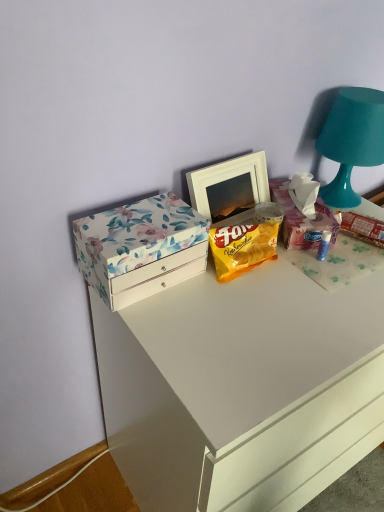
Question: From a real-world perspective, is teal matte table lamp at upper right positioned above or below white glossy chest of drawers at upper center?

Choices:
 (A) below
 (B) above

Answer: (B)

Question: From the image's perspective, is teal matte table lamp at upper right above or below white glossy chest of drawers at upper center?

Choices:
 (A) below
 (B) above

Answer: (B)

Question: Considering the real-world distances, which object is closest to the floral cardboard box at upper right?

Choices:
 (A) teal matte table lamp at upper right
 (B) white glossy chest of drawers at upper center
 (C) floral paper box at left
 (D) white matte picture frame at center

Answer: (D)

Question: Based on their relative distances, which object is nearer to the floral paper box at left?

Choices:
 (A) floral cardboard box at upper right
 (B) white matte picture frame at center
 (C) white glossy chest of drawers at upper center
 (D) teal matte table lamp at upper right

Answer: (B)